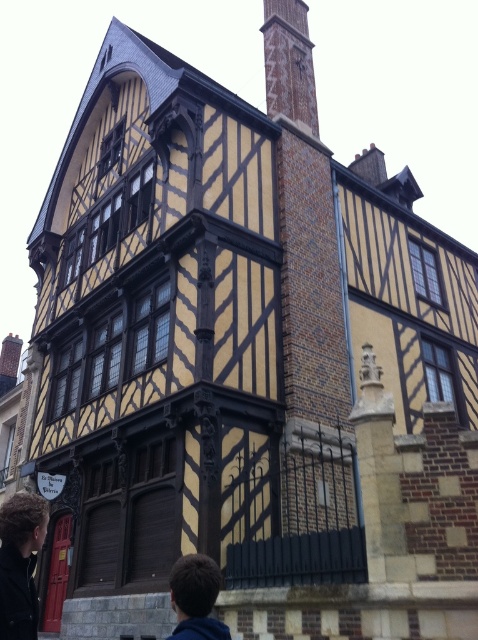
Question: Which object is the farthest from the brown hair at lower center?

Choices:
 (A) brick chimney at upper center
 (B) dark brown hair at lower left

Answer: (A)

Question: Is brick chimney at upper center to the right of dark brown hair at lower left from the viewer's perspective?

Choices:
 (A) no
 (B) yes

Answer: (B)

Question: Does brick chimney at upper center come in front of brown hair at lower center?

Choices:
 (A) yes
 (B) no

Answer: (B)

Question: Is dark brown hair at lower left wider than brown hair at lower center?

Choices:
 (A) no
 (B) yes

Answer: (A)

Question: Considering the real-world distances, which object is farthest from the dark brown hair at lower left?

Choices:
 (A) brown hair at lower center
 (B) brick chimney at upper center

Answer: (B)

Question: Which of the following is the farthest from the observer?

Choices:
 (A) brown hair at lower center
 (B) brick chimney at upper center
 (C) dark brown hair at lower left

Answer: (B)